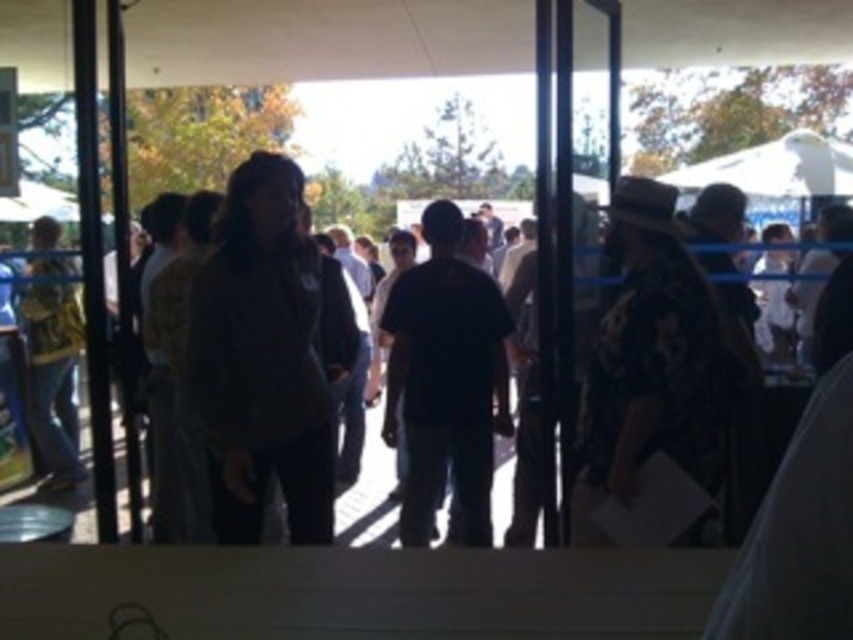
Can you confirm if black matte shirt at center is smaller than dark gray jacket at center?

Indeed, black matte shirt at center has a smaller size compared to dark gray jacket at center.

Based on the photo, does black matte shirt at center come in front of dark gray jacket at center?

Yes, it is in front of dark gray jacket at center.

Measure the distance between point (473, 481) and camera.

Point (473, 481) is 4.09 meters from camera.

Locate an element on the screen. Image resolution: width=853 pixels, height=640 pixels. black matte shirt at center is located at coordinates (445, 380).

Does transparent glass door at center have a lesser height compared to dark gray jacket at center?

No.

Does transparent glass door at center come in front of dark gray jacket at center?

Yes, transparent glass door at center is in front of dark gray jacket at center.

The height and width of the screenshot is (640, 853). Find the location of `transparent glass door at center`. transparent glass door at center is located at coordinates (555, 259).

You are a GUI agent. You are given a task and a screenshot of the screen. Output one action in this format:
    pyautogui.click(x=<x>, y=<y>)
    Task: Click on the transparent glass door at center
    This screenshot has height=640, width=853.
    Given the screenshot: What is the action you would take?
    pyautogui.click(x=555, y=259)

Does black matte shirt at center have a greater width compared to transparent glass door at center?

Yes.

Does point (479, 340) come in front of point (549, 262)?

No, it is behind (549, 262).

This screenshot has height=640, width=853. Find the location of `black matte shirt at center`. black matte shirt at center is located at coordinates (445, 380).